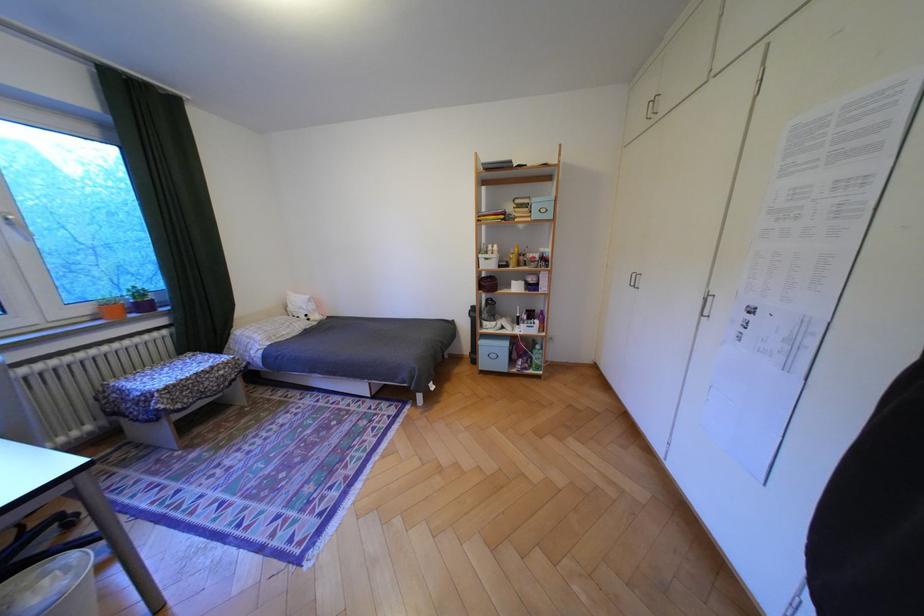
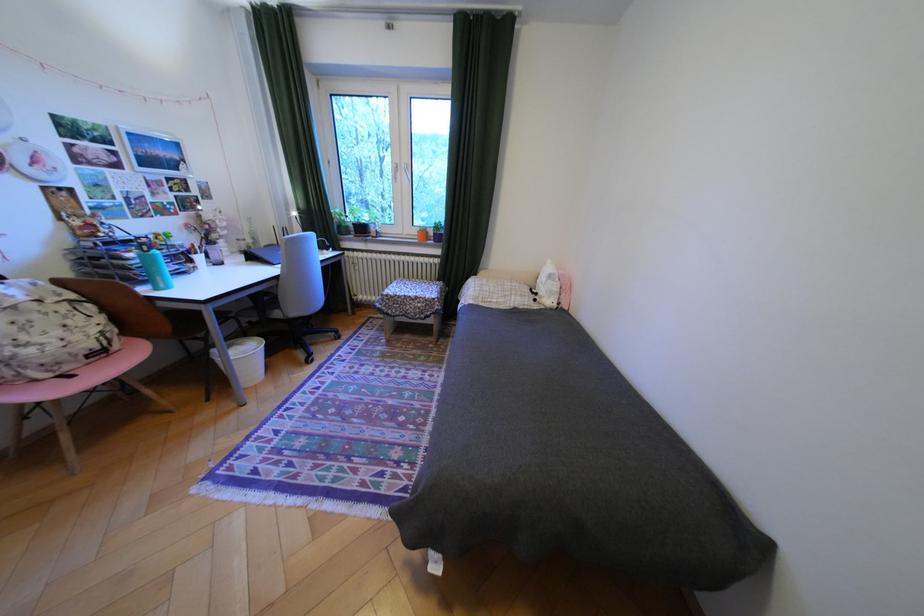
Find the pixel in the second image that matches point (99, 310) in the first image.

(427, 232)